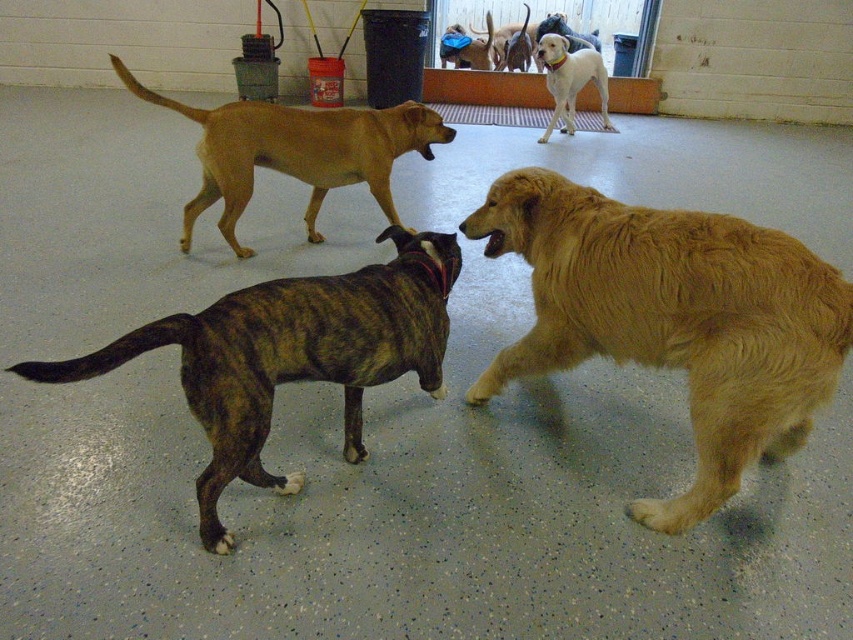
You are a dog trainer who needs to separate two dogs that are getting too close. The golden brown fur at center and the blue fabric dog at center are both in the center of the kennel. Can you safely walk between them without getting too close to either?

The golden brown fur at center and the blue fabric dog at center are 4.12 meters apart, so yes, you can safely walk between them as the distance is sufficient to avoid getting too close to either dog.

You are a photographer standing in the kennel and want to take a closeup shot of the golden brown fur at center. The camera you have can focus on objects within 2 meters. Can you take the photo without moving closer?

The golden brown fur at center is 2.75 meters from the camera, which is beyond the camera focus range of 2 meters. Therefore, you cannot take the photo without moving closer.